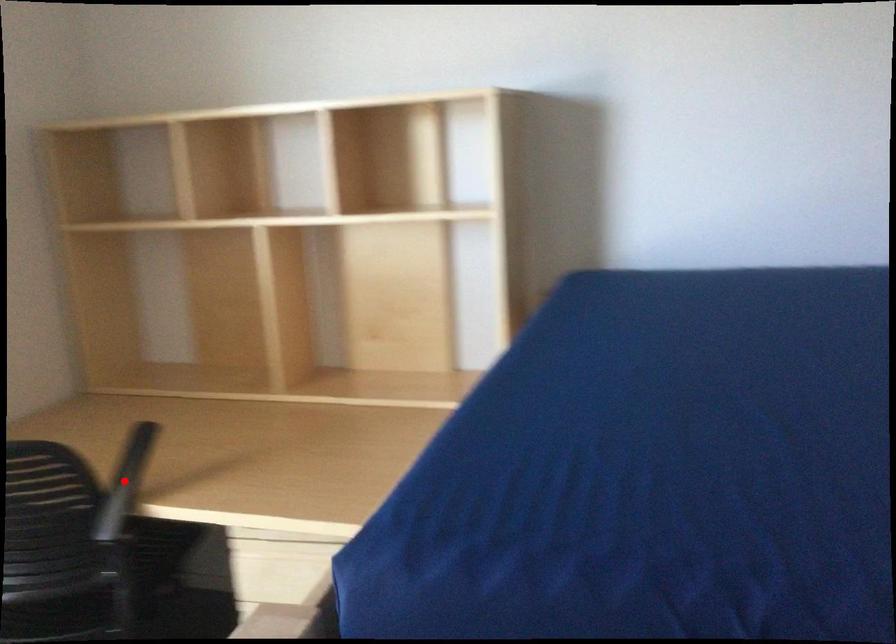
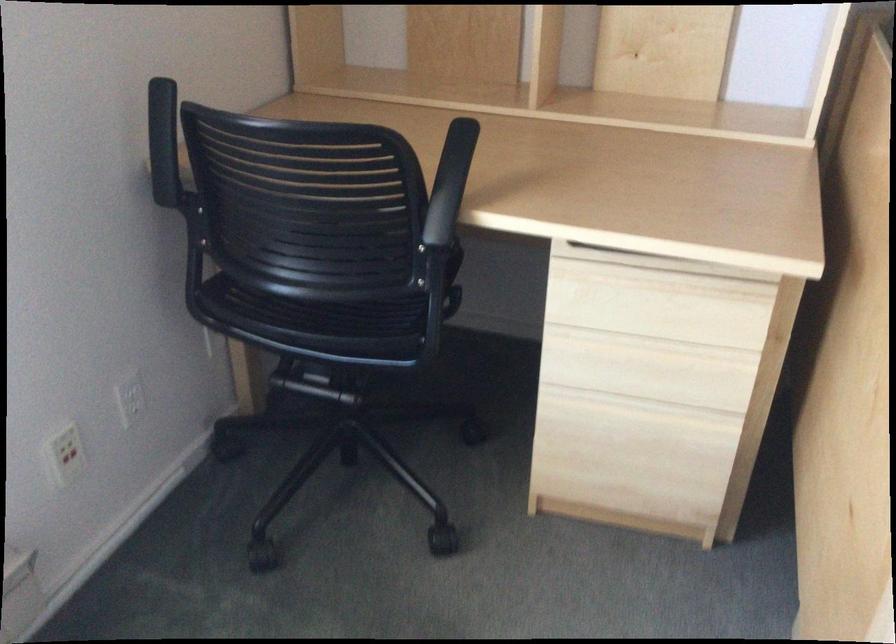
Where in the second image is the point corresponding to the highlighted location from the first image?

(450, 183)